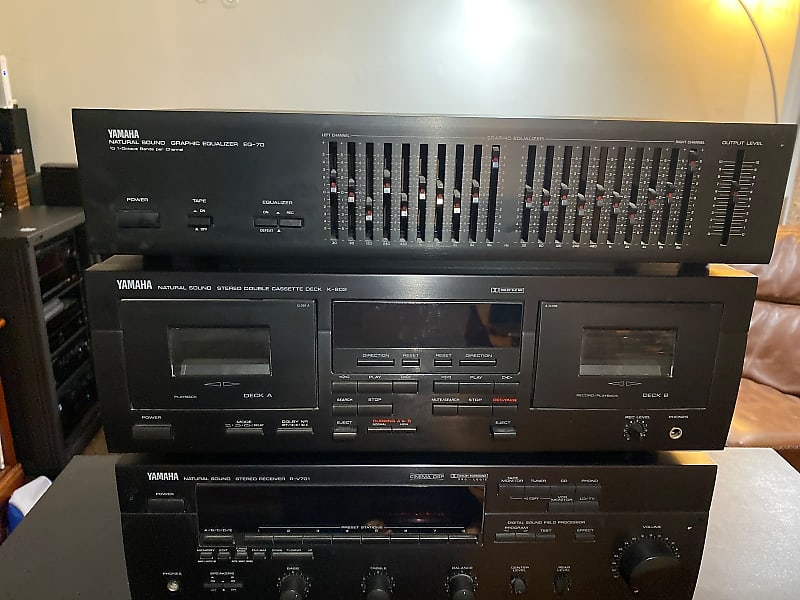
Locate an element on the screen. screen display is located at coordinates (422, 371).